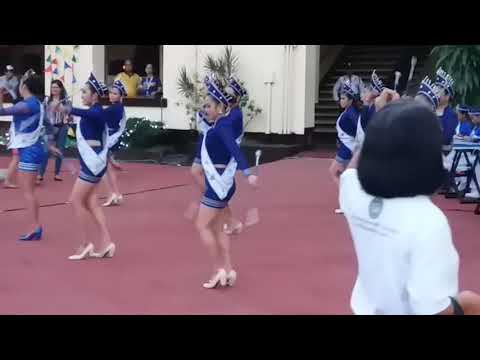
This screenshot has height=360, width=480. I want to click on plant, so click(x=190, y=85).